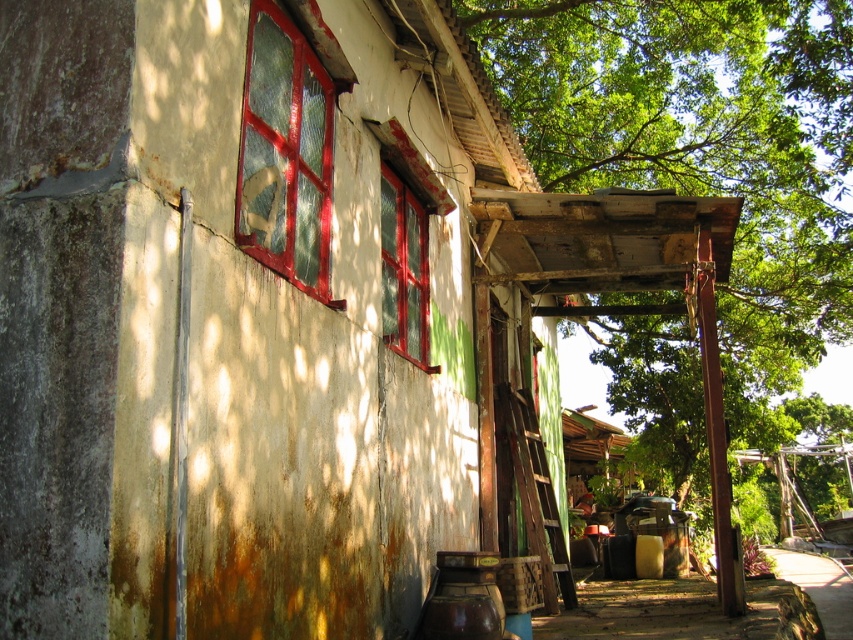
Does green leafy tree at upper right have a lesser height compared to brown wooden alley at lower right?

No.

Is point (816, 243) farther from camera compared to point (830, 609)?

Yes, point (816, 243) is behind point (830, 609).

Which is in front, point (650, 125) or point (837, 572)?

Point (650, 125) is in front.

Locate an element on the screen. The image size is (853, 640). green leafy tree at upper right is located at coordinates (704, 147).

Can you confirm if cracked glass window at left is thinner than brown wooden alley at lower right?

Correct, cracked glass window at left's width is less than brown wooden alley at lower right's.

The height and width of the screenshot is (640, 853). I want to click on cracked glass window at left, so click(x=285, y=154).

Does point (850, 147) come closer to viewer compared to point (393, 268)?

No, (850, 147) is further to viewer.

Between green leafy tree at upper right and matte glass window at center, which one is positioned lower?

matte glass window at center is lower down.

Who is more forward, (722, 93) or (387, 196)?

Point (387, 196) is in front.

Where is `green leafy tree at upper right`? This screenshot has width=853, height=640. green leafy tree at upper right is located at coordinates (704, 147).